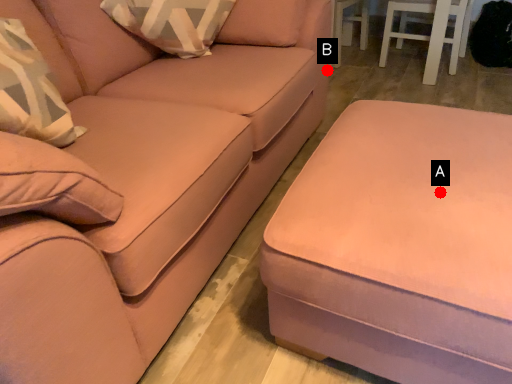
Question: Two points are circled on the image, labeled by A and B beside each circle. Which of the following is the farthest from the observer?

Choices:
 (A) A is further
 (B) B is further

Answer: (B)